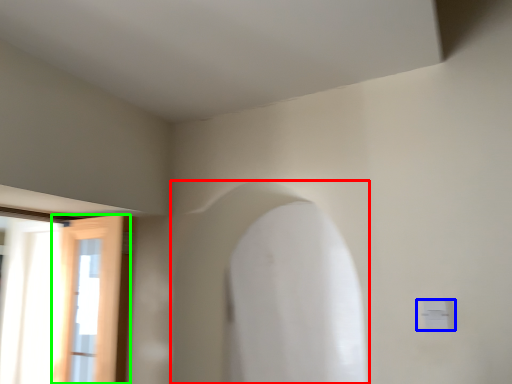
Question: Which object is the farthest from archway (highlighted by a red box)? Choose among these: electric outlet (highlighted by a blue box) or door (highlighted by a green box).

Choices:
 (A) electric outlet
 (B) door

Answer: (A)